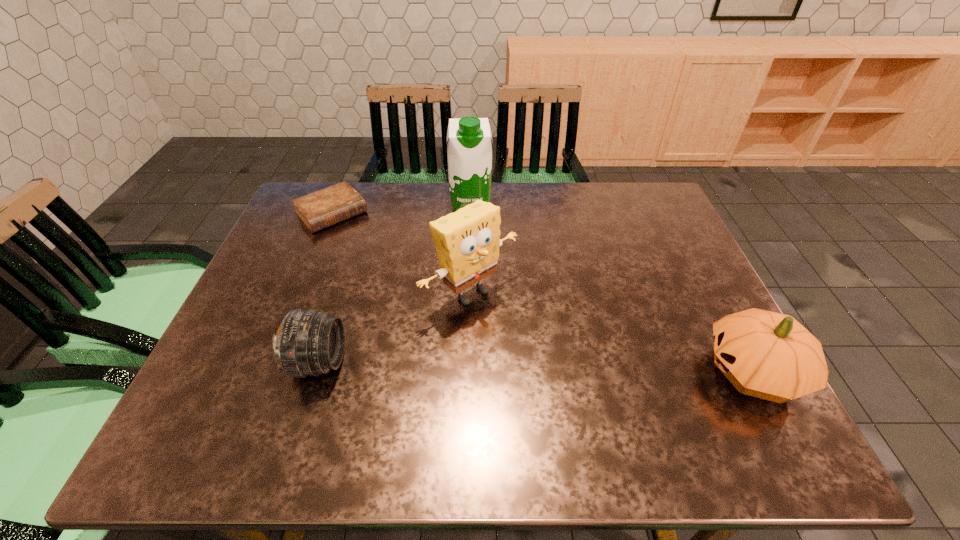
This screenshot has width=960, height=540. Find the location of `free space between the rightmost object and the diary`. free space between the rightmost object and the diary is located at coordinates click(x=542, y=293).

Identify which object is located as the fourth nearest to the diary. Please provide its 2D coordinates. Your answer should be formatted as a tuple, i.e. [(x, y)], where the tuple contains the x and y coordinates of a point satisfying the conditions above.

[(768, 355)]

Identify which object is the second nearest to the second shortest object. Please provide its 2D coordinates. Your answer should be formatted as a tuple, i.e. [(x, y)], where the tuple contains the x and y coordinates of a point satisfying the conditions above.

[(321, 209)]

Where is `free region that satisfies the following two spatial constraints: 1. on the front side of the fourth tallest object; 2. at the front element of the diary`? The image size is (960, 540). free region that satisfies the following two spatial constraints: 1. on the front side of the fourth tallest object; 2. at the front element of the diary is located at coordinates (272, 362).

I want to click on vacant space that satisfies the following two spatial constraints: 1. on the front side of the soya milk; 2. on the side of the gourd with the carved face, so pyautogui.click(x=466, y=372).

Find the location of a particular element. free spot that satisfies the following two spatial constraints: 1. on the front side of the soya milk; 2. on the side of the rightmost object with the carved face is located at coordinates (466, 372).

At what (x,y) coordinates should I click in order to perform the action: click on vacant region that satisfies the following two spatial constraints: 1. on the front side of the sponge; 2. on the side of the third tallest object with the carved face. Please return your answer as a coordinate pair (x, y). Looking at the image, I should click on (468, 372).